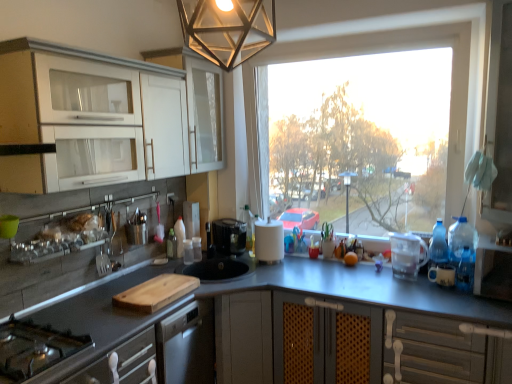
I want to click on vacant space situated on the left part of orange matte at counter, so click(x=325, y=269).